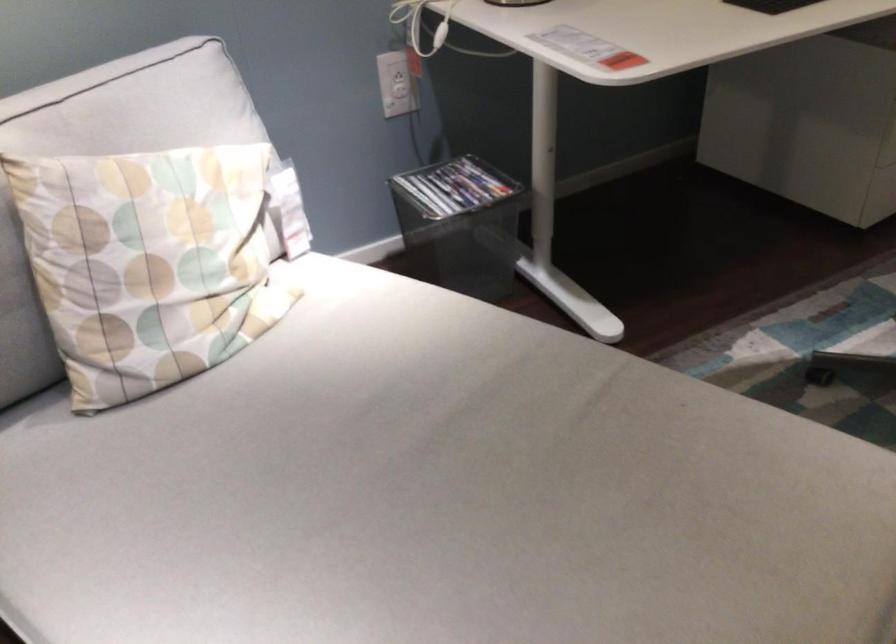
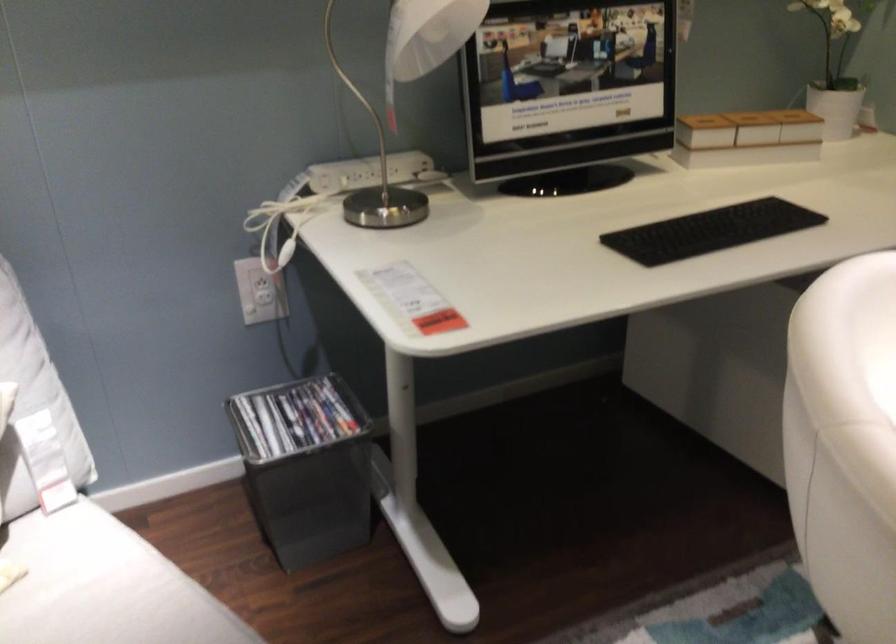
In a continuous first-person perspective shot, in which direction is the camera moving?

The movement direction of the cameraman is right, forward.